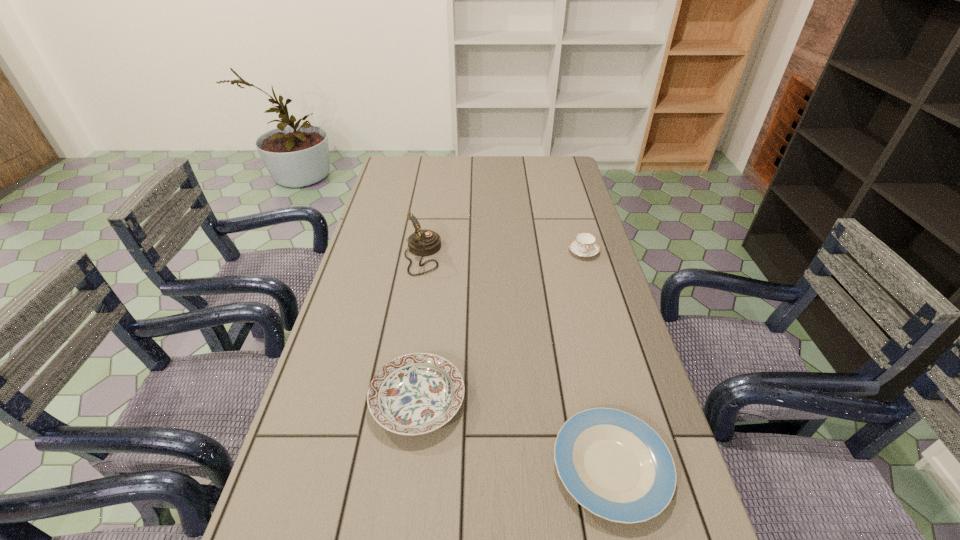
Where is `vacant area that lies between the shorter plate and the teacup`? The image size is (960, 540). vacant area that lies between the shorter plate and the teacup is located at coordinates (597, 359).

At what (x,y) coordinates should I click in order to perform the action: click on free space that is in between the telephone and the shorter plate. Please return your answer as a coordinate pair (x, y). This screenshot has height=540, width=960. Looking at the image, I should click on (516, 361).

Where is `free point between the third shortest object and the third tallest object`? This screenshot has width=960, height=540. free point between the third shortest object and the third tallest object is located at coordinates (500, 326).

Locate an element on the screen. vacant point located between the tallest object and the third shortest object is located at coordinates (503, 254).

Locate an element on the screen. free space that is in between the second tallest object and the telephone is located at coordinates (503, 254).

Locate an element on the screen. This screenshot has width=960, height=540. free space between the right plate and the taller plate is located at coordinates (515, 434).

Where is `empty space that is in between the third shortest object and the second shortest object`? empty space that is in between the third shortest object and the second shortest object is located at coordinates (500, 326).

This screenshot has width=960, height=540. Identify the location of free space between the left plate and the third shortest object. (500, 326).

The width and height of the screenshot is (960, 540). Find the location of `free space between the tallest object and the second shortest object`. free space between the tallest object and the second shortest object is located at coordinates (420, 328).

Where is `object that is the second closest to the tallest object`? This screenshot has width=960, height=540. object that is the second closest to the tallest object is located at coordinates (584, 245).